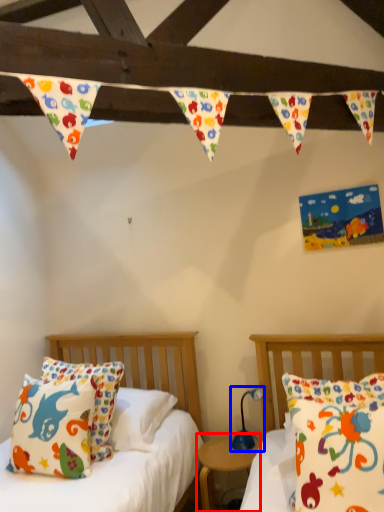
Question: Which of the following is the closest to the observer, nightstand (highlighted by a red box) or lamp (highlighted by a blue box)?

Choices:
 (A) nightstand
 (B) lamp

Answer: (A)